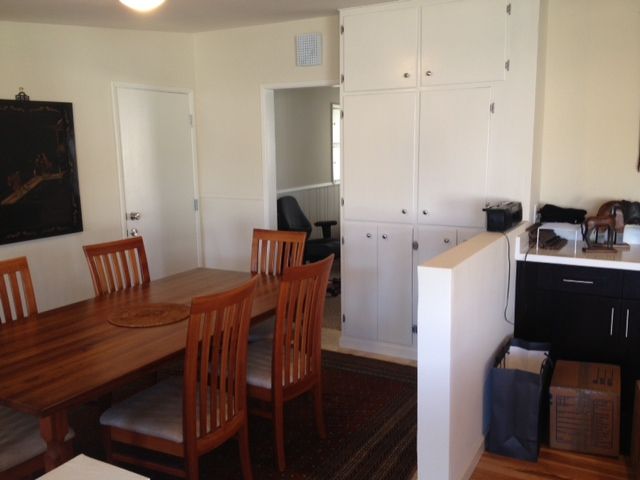
I want to click on brown hardwood floor, so click(331, 336).